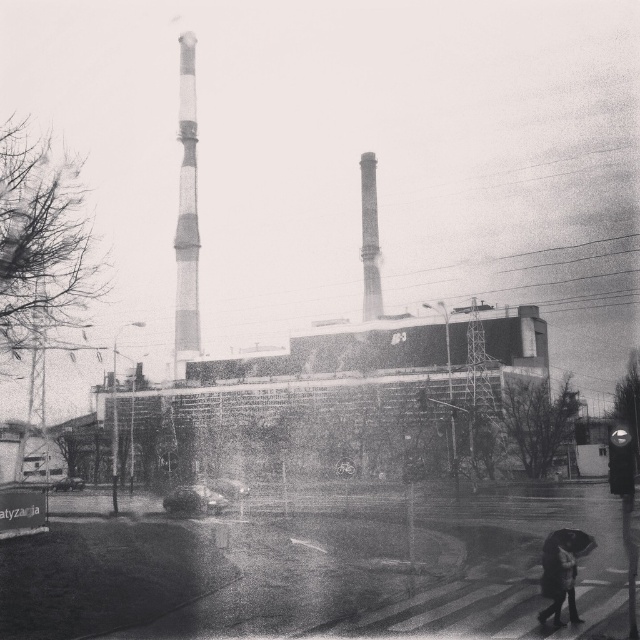
Does white striped tower at center have a smaller size compared to dark textured coat at lower right?

Incorrect, white striped tower at center is not smaller in size than dark textured coat at lower right.

Who is higher up, white striped tower at center or dark textured coat at lower right?

white striped tower at center is higher up.

The height and width of the screenshot is (640, 640). What do you see at coordinates (186, 216) in the screenshot? I see `white striped tower at center` at bounding box center [186, 216].

Find the location of a particular element. This screenshot has height=640, width=640. white striped tower at center is located at coordinates (186, 216).

Who is more distant from viewer, (188, 304) or (362, 269)?

The point (362, 269) is behind.

Based on the photo, is white striped tower at center further to camera compared to smooth concrete chimney at center?

Yes, it is behind smooth concrete chimney at center.

Who is more distant from viewer, (x=193, y=88) or (x=369, y=266)?

The point (x=193, y=88) is behind.

Identify the location of white striped tower at center. [186, 216].

Between point (179, 188) and point (550, 540), which one is positioned in front?

Point (550, 540)

Which of these two, white striped tower at center or transparent plastic umbrella at lower right, stands taller?

Standing taller between the two is white striped tower at center.

In order to click on white striped tower at center in this screenshot , I will do 186,216.

In order to click on white striped tower at center in this screenshot , I will do `click(186, 216)`.